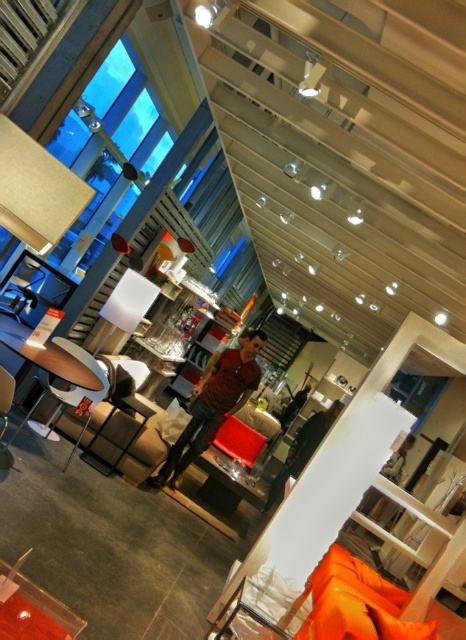
Is point (413, 630) more distant than point (6, 464)?

No, it is in front of (6, 464).

Which is below, orange fabric pillow at lower right or matte black armchair at lower left?

orange fabric pillow at lower right is below.

The image size is (466, 640). I want to click on orange fabric pillow at lower right, so 399,625.

Image resolution: width=466 pixels, height=640 pixels. Describe the element at coordinates (357, 604) in the screenshot. I see `orange fabric couch at lower right` at that location.

The height and width of the screenshot is (640, 466). In order to click on orange fabric couch at lower right in this screenshot , I will do `click(357, 604)`.

Locate an element on the screen. orange fabric couch at lower right is located at coordinates (357, 604).

Is point (361, 628) farther from camera compared to point (19, 301)?

No, (361, 628) is closer to viewer.

Can you confirm if orange fabric couch at lower right is thinner than matte black armchair at center?

In fact, orange fabric couch at lower right might be wider than matte black armchair at center.

You are a GUI agent. You are given a task and a screenshot of the screen. Output one action in this format:
    pyautogui.click(x=<x>, y=<y>)
    Task: Click on the orange fabric couch at lower right
    
    Given the screenshot: What is the action you would take?
    pyautogui.click(x=357, y=604)

The height and width of the screenshot is (640, 466). I want to click on orange fabric couch at lower right, so click(357, 604).